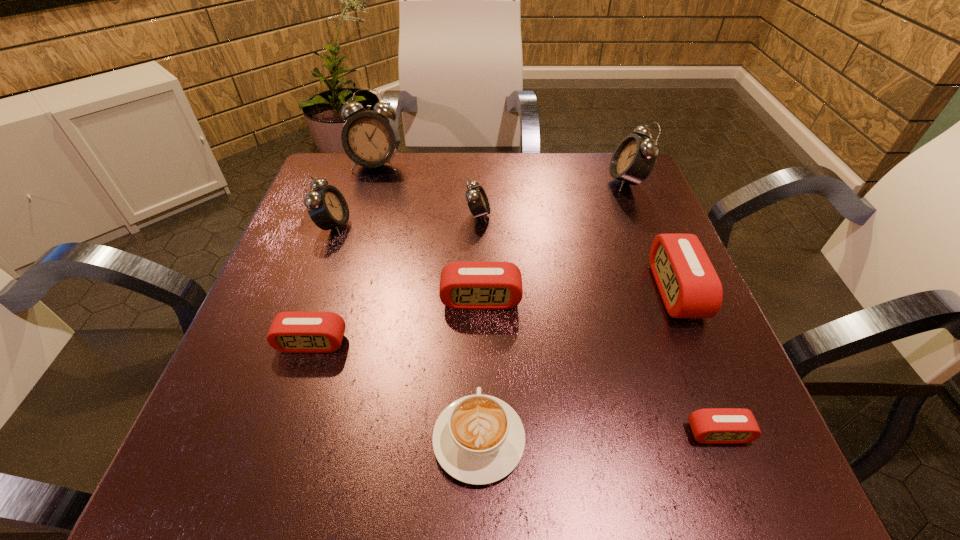
Where is `the tallest object`? Image resolution: width=960 pixels, height=540 pixels. the tallest object is located at coordinates (370, 139).

Locate an element on the screen. the tallest alarm clock is located at coordinates (370, 139).

This screenshot has height=540, width=960. Find the location of `the third smallest white alarm clock`. the third smallest white alarm clock is located at coordinates (634, 158).

The height and width of the screenshot is (540, 960). I want to click on the rightmost white alarm clock, so click(634, 158).

Find the location of a particular element. the third tallest alarm clock is located at coordinates (327, 207).

Find the location of a particular element. This screenshot has height=540, width=960. the third biggest white alarm clock is located at coordinates (327, 207).

Identify the location of the third white alarm clock from left to right. Image resolution: width=960 pixels, height=540 pixels. (477, 200).

Find the location of a particular element. The image size is (960, 540). the biggest pink alarm clock is located at coordinates (690, 288).

Where is `the sixth tallest object`? The image size is (960, 540). the sixth tallest object is located at coordinates (480, 285).

Locate an element on the screen. This screenshot has height=540, width=960. the second biggest pink alarm clock is located at coordinates (480, 285).